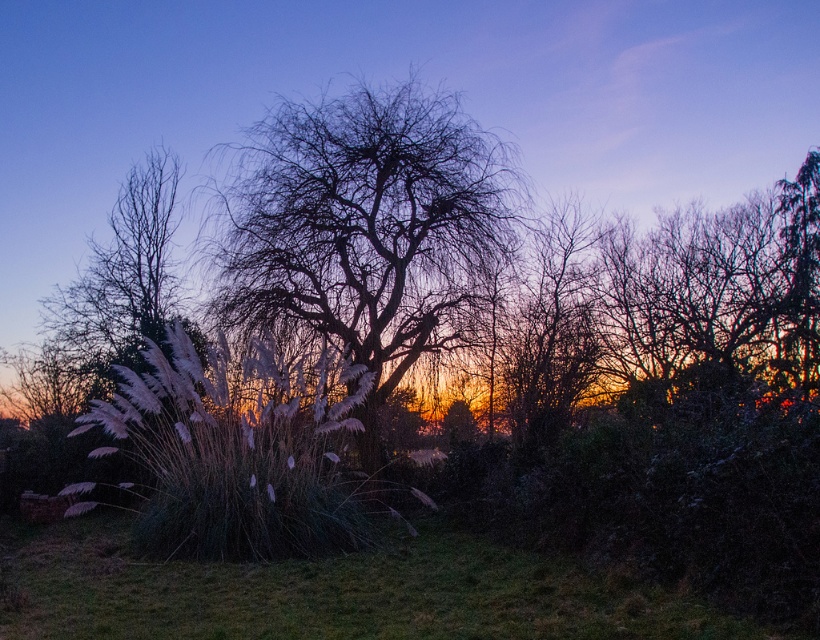
You are standing in the scene and want to step onto the green grass at lower center. Which direction should you move to reach it from your current position near the white fluffy grass at left?

The green grass at lower center is closer to the viewer than the white fluffy grass at left, so you should move forward towards the lower center direction to reach it.

You are an artist trying to paint this scene. You want to ensure that the bare branches at center and the white fluffy grass at left are proportionally accurate. Which object should you paint smaller to maintain the correct proportions?

The bare branches at center should be painted smaller because it occupies less space than the white fluffy grass at left according to the description.